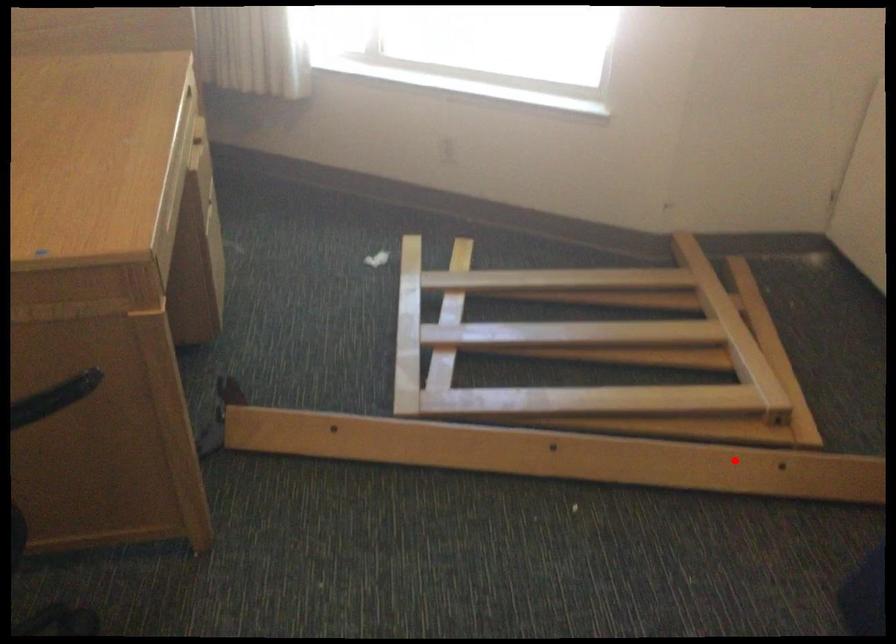
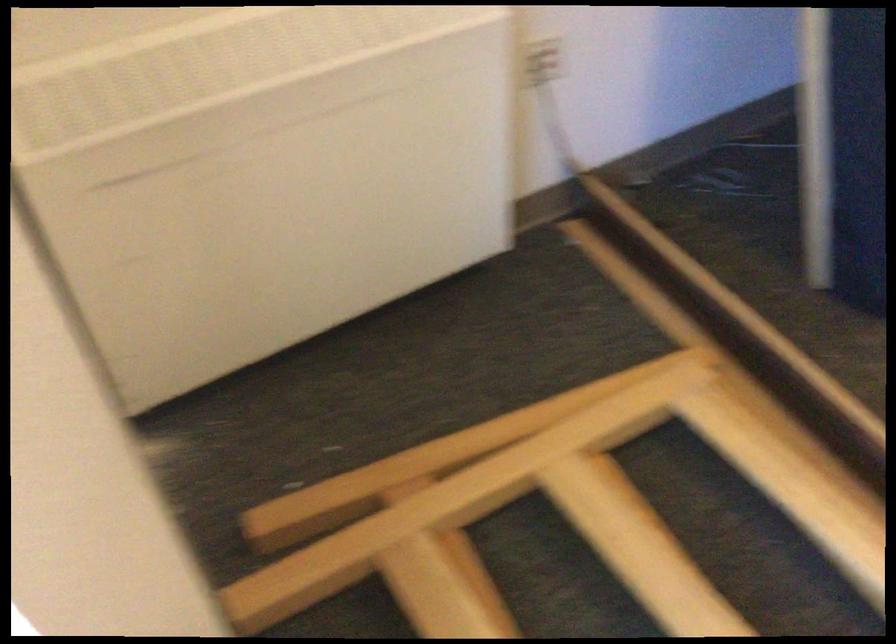
In the second image, find the point that corresponds to the highlighted location in the first image.

(777, 418)